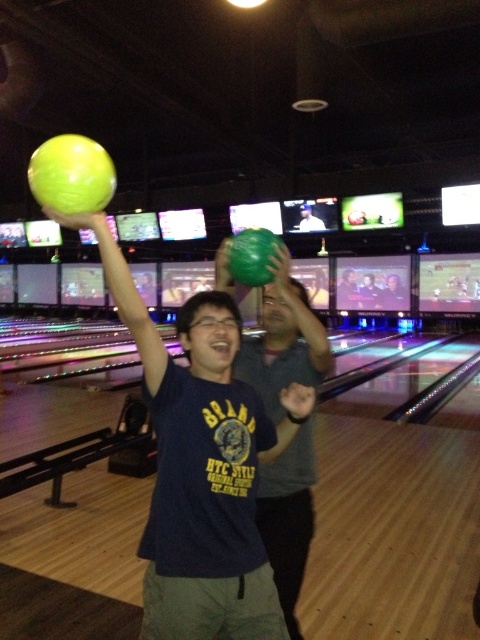
Question: Is green rubber bowling ball at upper left wider than matte green bowling ball at center?

Choices:
 (A) yes
 (B) no

Answer: (B)

Question: Among these points, which one is nearest to the camera?

Choices:
 (A) (247, 257)
 (B) (316, 224)

Answer: (A)

Question: From the image, what is the correct spatial relationship of matte green bowling ball at upper center in relation to green rubber bowling ball at upper left?

Choices:
 (A) right
 (B) left

Answer: (A)

Question: Which point is closer to the camera taking this photo?

Choices:
 (A) (36, 193)
 (B) (291, 289)
 (C) (264, 234)
 (D) (304, 211)

Answer: (A)

Question: Is matte green bowling ball at upper center below green matte bowling ball at center?

Choices:
 (A) yes
 (B) no

Answer: (A)

Question: Among these objects, which one is farthest from the camera?

Choices:
 (A) matte green bowling ball at center
 (B) matte green bowling ball at upper center
 (C) green rubber bowling ball at upper center

Answer: (A)